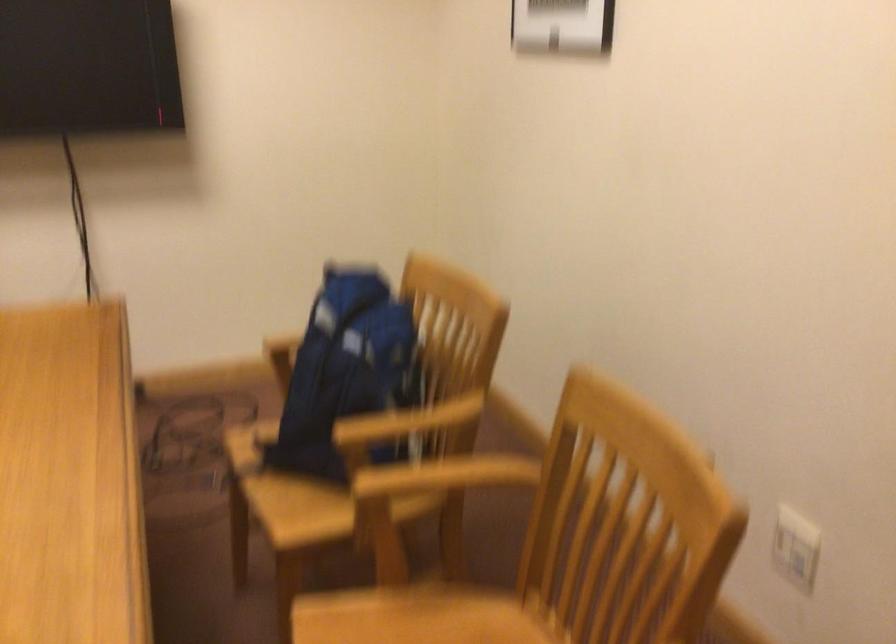
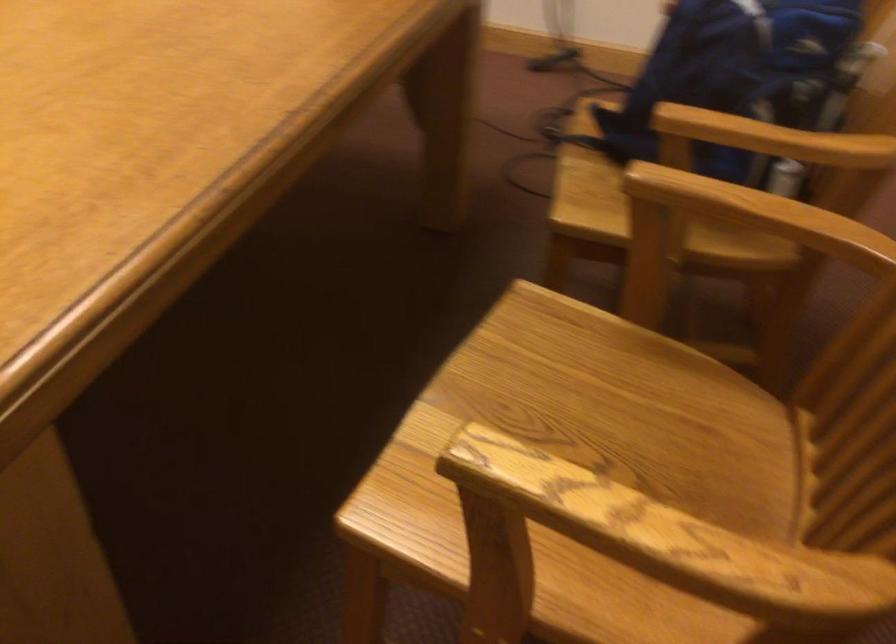
Locate, in the second image, the point that corresponds to [363,386] in the first image.

(736, 73)